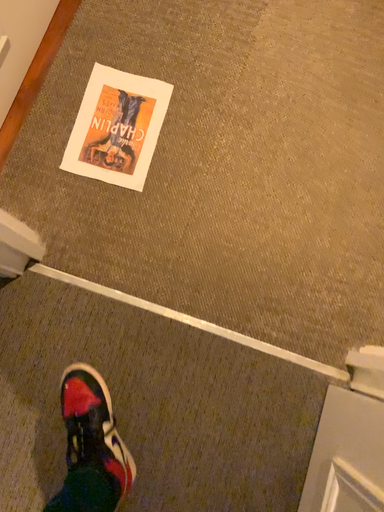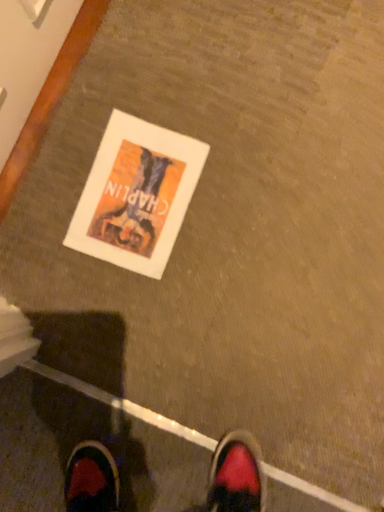
Question: Which way did the camera rotate in the video?

Choices:
 (A) rotated upward
 (B) rotated downward

Answer: (B)